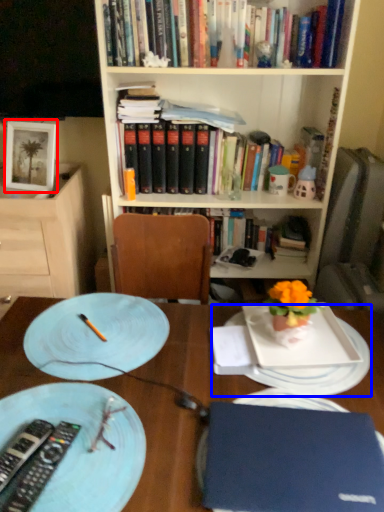
Question: Which of the following is the farthest to the observer, picture frame (highlighted by a red box) or platter (highlighted by a blue box)?

Choices:
 (A) picture frame
 (B) platter

Answer: (A)